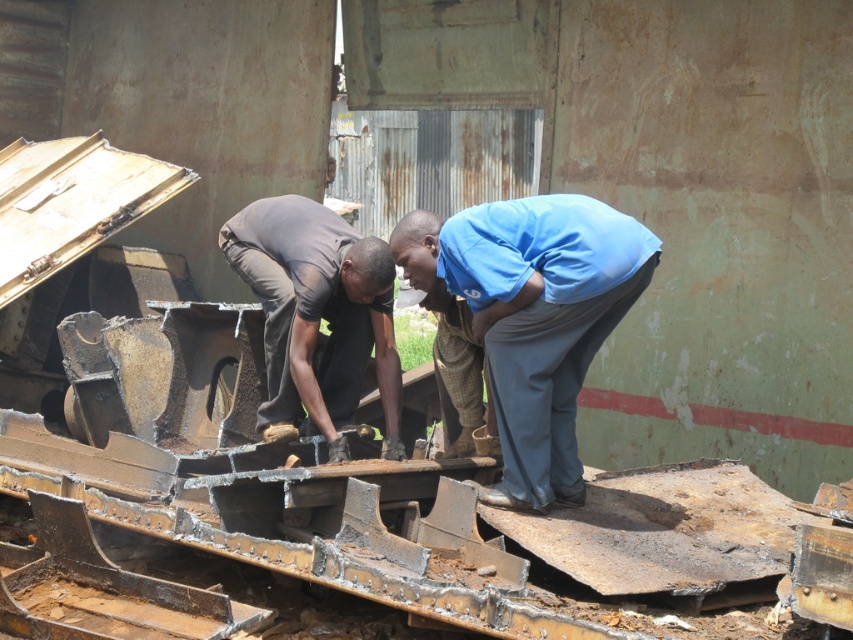
You are a safety inspector at the construction site. You need to ensure that the blue fabric shirt at center and the dark brown fabric shirt at center are within the safety zone. The safety zone is 1.8 meters wide. Can both workers stand side by side within the safety zone without overlapping?

Answer: The blue fabric shirt at center is wider than the dark brown fabric shirt at center. However, the combined width of both shirts is not provided. Without knowing the exact widths, it is impossible to determine if they can fit within the 1.8 meter safety zone. Additional measurements are required.

You are standing at the origin point of the image. A blue fabric shirt at center is represented by point (532, 316). Can you tell me the coordinates of the blue fabric shirt at center?

The coordinates of the blue fabric shirt at center are (532, 316).